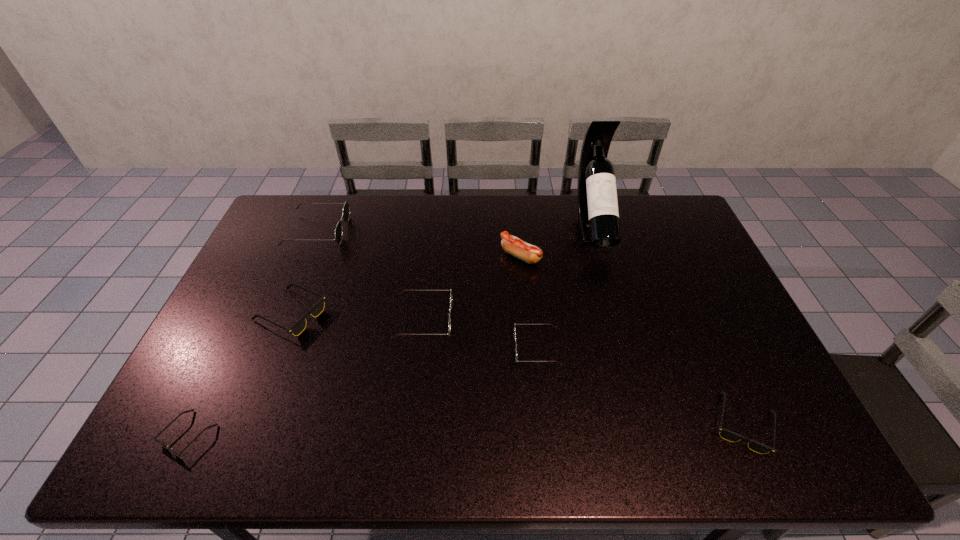
Image resolution: width=960 pixels, height=540 pixels. Identify the location of vacant space that's between the brown sausage and the shortest sunglasses. (354, 346).

Where is `free area in between the second biggest green sunglasses and the brown sausage`? This screenshot has height=540, width=960. free area in between the second biggest green sunglasses and the brown sausage is located at coordinates (472, 288).

Identify which object is located as the seventh nearest to the tallest sunglasses. Please provide its 2D coordinates. Your answer should be formatted as a tuple, i.e. [(x, y)], where the tuple contains the x and y coordinates of a point satisfying the conditions above.

[(726, 434)]

Point out which object is positioned as the nearest to the biggest green sunglasses. Please provide its 2D coordinates. Your answer should be formatted as a tuple, i.e. [(x, y)], where the tuple contains the x and y coordinates of a point satisfying the conditions above.

[(299, 326)]

Where is `sunglasses that is the sixth closest to the black wine bottle`? Image resolution: width=960 pixels, height=540 pixels. sunglasses that is the sixth closest to the black wine bottle is located at coordinates (154, 438).

Locate which sunglasses ranks in proximity to the shortest sunglasses. Please provide its 2D coordinates. Your answer should be formatted as a tuple, i.e. [(x, y)], where the tuple contains the x and y coordinates of a point satisfying the conditions above.

[(299, 326)]

Where is `the second closest green sunglasses to the biggest black sunglasses`? the second closest green sunglasses to the biggest black sunglasses is located at coordinates (449, 327).

At what (x,y) coordinates should I click in order to perform the action: click on the second closest green sunglasses relative to the leftmost green sunglasses. Please return your answer as a coordinate pair (x, y). The image size is (960, 540). Looking at the image, I should click on (514, 323).

The height and width of the screenshot is (540, 960). Identify the location of black sunglasses identified as the closest to the rightmost black sunglasses. (299, 326).

This screenshot has width=960, height=540. I want to click on black sunglasses that can be found as the third closest to the farthest green sunglasses, so click(726, 434).